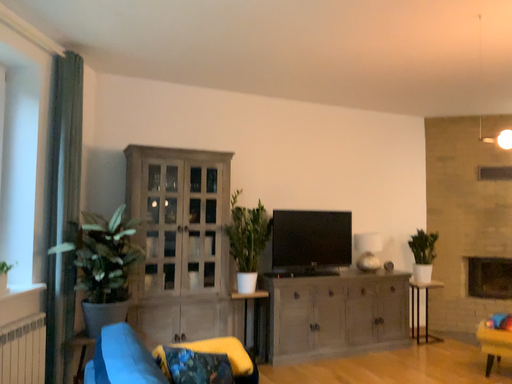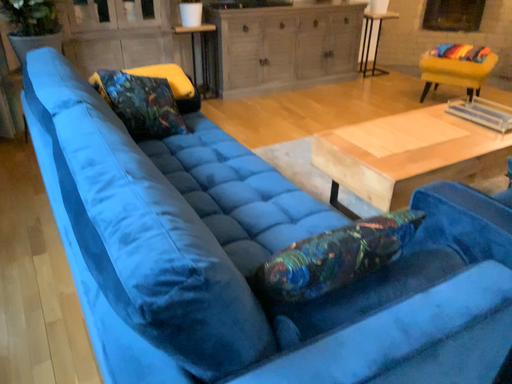
Question: Which way did the camera rotate in the video?

Choices:
 (A) rotated downward
 (B) rotated upward

Answer: (A)